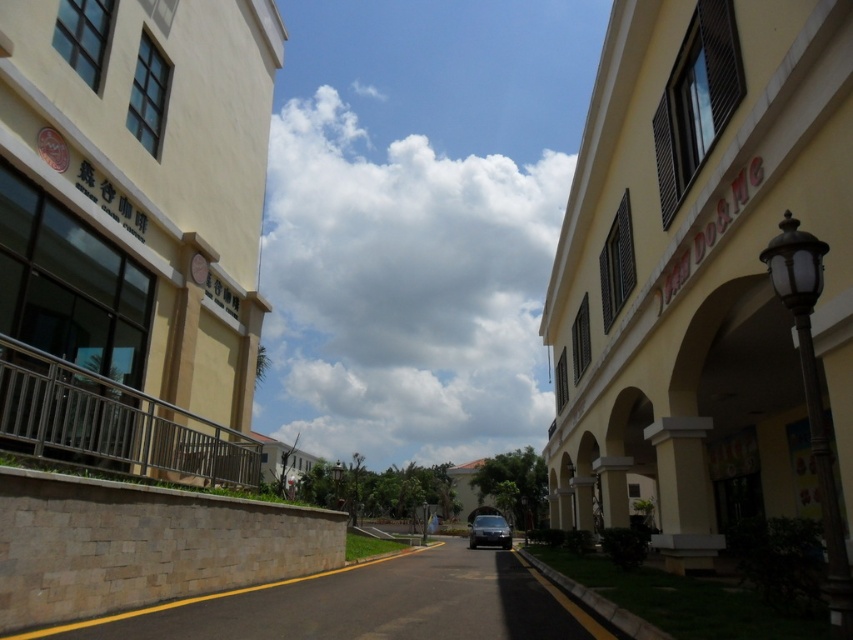
Does black asphalt road at center appear on the right side of satin black car at center?

No, black asphalt road at center is not to the right of satin black car at center.

Based on the photo, can you confirm if black asphalt road at center is taller than satin black car at center?

No, black asphalt road at center is not taller than satin black car at center.

The width and height of the screenshot is (853, 640). In order to click on black asphalt road at center in this screenshot , I will do `click(367, 604)`.

Looking at this image, is yellow matte building at right taller than beige stucco building at left?

Yes, yellow matte building at right is taller than beige stucco building at left.

Between yellow matte building at right and beige stucco building at left, which one appears on the left side from the viewer's perspective?

Positioned to the left is beige stucco building at left.

Consider the image. Who is more distant from viewer, (695, 284) or (3, 33)?

Point (695, 284)

The height and width of the screenshot is (640, 853). Identify the location of yellow matte building at right. (700, 268).

Who is lower down, beige stucco building at left or satin black car at center?

satin black car at center

Does beige stucco building at left come behind satin black car at center?

That is False.

Does point (238, 483) lie behind point (474, 524)?

No, (238, 483) is closer to viewer.

This screenshot has height=640, width=853. I want to click on beige stucco building at left, so click(134, 228).